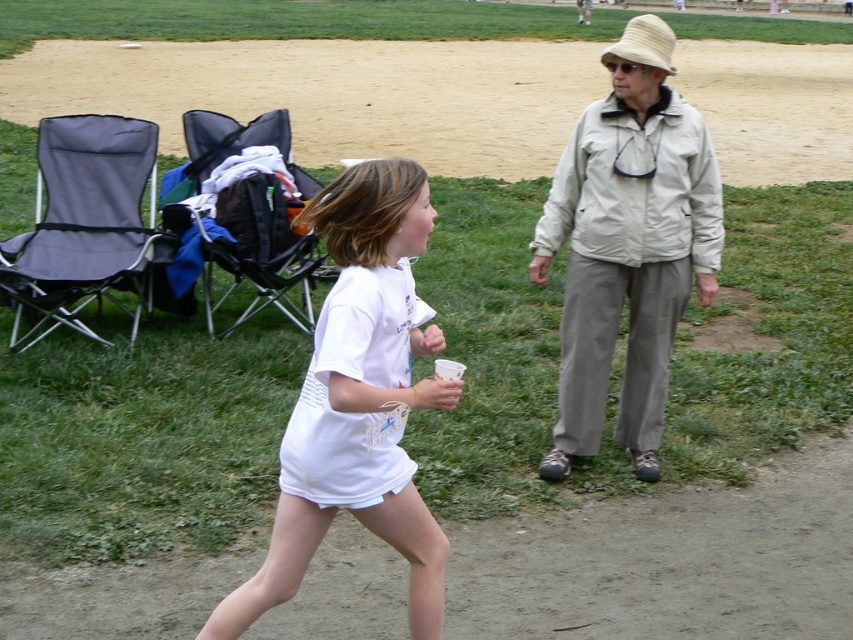
Question: Does brown dirt track at center appear on the right side of black fabric baby carriage at left?

Choices:
 (A) no
 (B) yes

Answer: (A)

Question: Estimate the real-world distances between objects in this image. Which object is closer to the beige fabric jacket at center?

Choices:
 (A) white matte shirt at center
 (B) brown dirt track at center

Answer: (A)

Question: Which point is closer to the camera?

Choices:
 (A) black fabric baby carriage at left
 (B) white matte shirt at center

Answer: (B)

Question: Can you confirm if brown dirt track at center is smaller than black fabric baby carriage at left?

Choices:
 (A) no
 (B) yes

Answer: (A)

Question: Does beige fabric jacket at center appear under black fabric baby carriage at left?

Choices:
 (A) no
 (B) yes

Answer: (B)

Question: Which object is closer to the camera taking this photo?

Choices:
 (A) black fabric baby carriage at left
 (B) brown dirt track at center

Answer: (A)